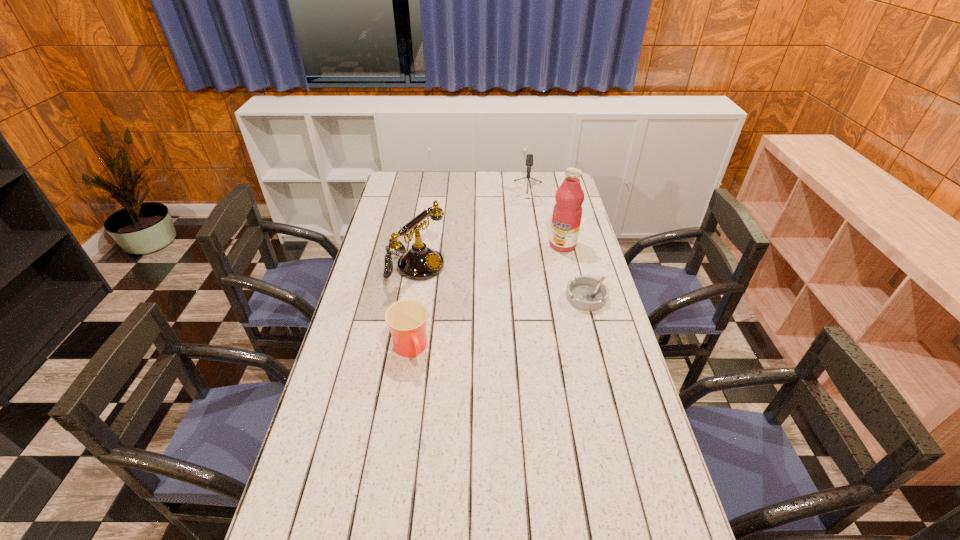
Identify the location of free space on the desktop that is between the nearest object and the shortest object and is positioned on the label of the tallest object. (484, 328).

I want to click on free space on the desktop that is between the cup and the ashtray and is positioned on the dial of the telephone, so click(x=529, y=315).

Find the location of `vacant space on the desktop that is between the nearest object and the ashtray and is positioned on the stand of the microphone`. vacant space on the desktop that is between the nearest object and the ashtray and is positioned on the stand of the microphone is located at coordinates (516, 319).